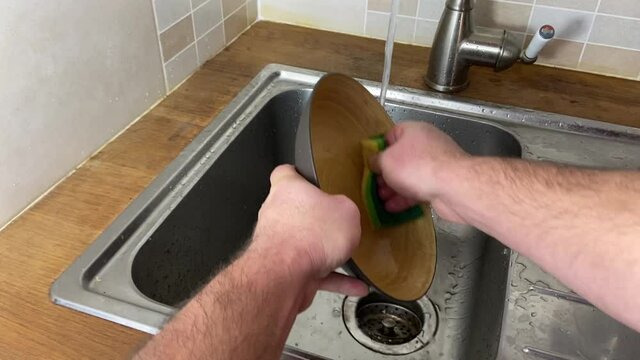
At what (x,y) coordinates should I click in order to perform the action: click on kitchen surface to left of sink. Please return your answer as a coordinate pair (x, y). This screenshot has width=640, height=360. Looking at the image, I should click on 73,200.